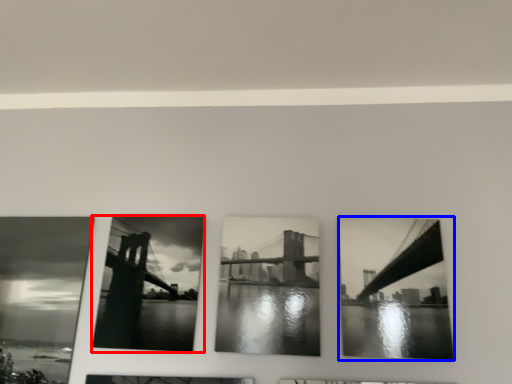
Question: Among these objects, which one is farthest to the camera, picture frame (highlighted by a red box) or picture frame (highlighted by a blue box)?

Choices:
 (A) picture frame
 (B) picture frame

Answer: (A)